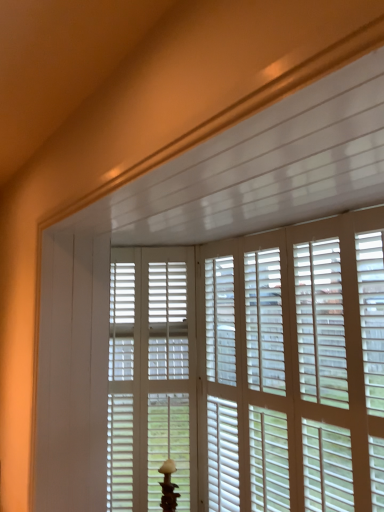
Question: Is white matte screen door at center inside or outside of white matte table lamp at center?

Choices:
 (A) inside
 (B) outside

Answer: (B)

Question: Looking at their shapes, would you say white matte screen door at center is wider or thinner than white matte table lamp at center?

Choices:
 (A) wide
 (B) thin

Answer: (B)

Question: Based on their relative distances, which object is farther from the white matte window blind at center?

Choices:
 (A) white matte table lamp at center
 (B) white matte screen door at center

Answer: (A)

Question: Which of these objects is positioned closest to the white matte window blind at center?

Choices:
 (A) white matte screen door at center
 (B) white matte table lamp at center

Answer: (A)